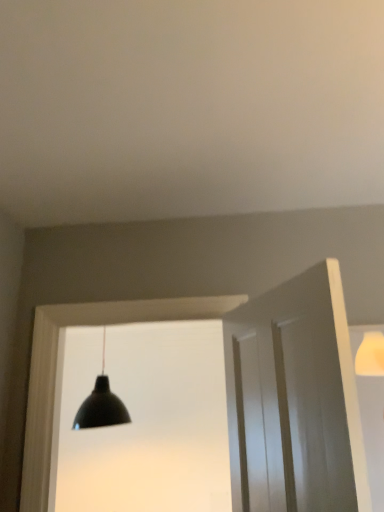
Question: From the image's perspective, is white smooth door at right beneath black matte lamp at center?

Choices:
 (A) yes
 (B) no

Answer: (B)

Question: Is there a large distance between white smooth door at right and black matte lamp at center?

Choices:
 (A) no
 (B) yes

Answer: (B)

Question: Can you confirm if white smooth door at right is shorter than black matte lamp at center?

Choices:
 (A) yes
 (B) no

Answer: (A)

Question: Is black matte lamp at center completely or partially inside white smooth door at right?

Choices:
 (A) no
 (B) yes

Answer: (A)

Question: Considering the relative sizes of white smooth door at right and black matte lamp at center in the image provided, is white smooth door at right thinner than black matte lamp at center?

Choices:
 (A) yes
 (B) no

Answer: (A)

Question: From a real-world perspective, is white smooth door at right physically above black matte lamp at center?

Choices:
 (A) no
 (B) yes

Answer: (A)

Question: From a real-world perspective, is black matte lamp at center located beneath white wood door frame at center?

Choices:
 (A) no
 (B) yes

Answer: (A)

Question: Does black matte lamp at center have a lesser height compared to white wood door frame at center?

Choices:
 (A) no
 (B) yes

Answer: (B)

Question: Does black matte lamp at center come in front of white wood door frame at center?

Choices:
 (A) no
 (B) yes

Answer: (A)

Question: Is white wood door frame at center at the back of black matte lamp at center?

Choices:
 (A) yes
 (B) no

Answer: (B)

Question: Are black matte lamp at center and white wood door frame at center making contact?

Choices:
 (A) yes
 (B) no

Answer: (B)

Question: Is black matte lamp at center to the left of white wood door frame at center from the viewer's perspective?

Choices:
 (A) no
 (B) yes

Answer: (B)

Question: Is white wood door frame at center touching white smooth door at right?

Choices:
 (A) no
 (B) yes

Answer: (B)